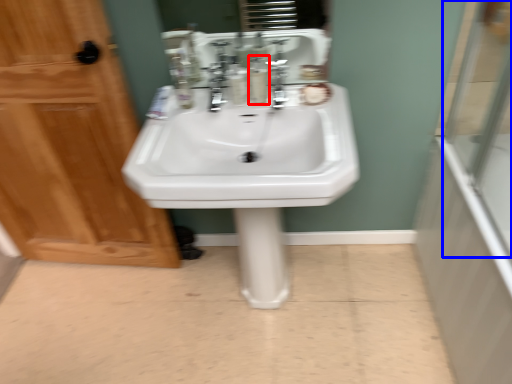
Question: Among these objects, which one is farthest to the camera, mouthwash (highlighted by a red box) or glass door (highlighted by a blue box)?

Choices:
 (A) mouthwash
 (B) glass door

Answer: (A)